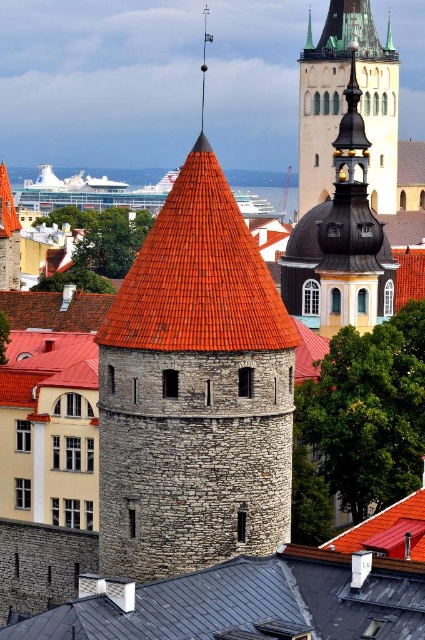
What is located at the coordinates point (252, 602) in the image of Tallinn, Estonia?

The black metal roof at center is located at point (252, 602).

You are standing at the base of the cylindrical stone tower in Tallinn and looking towards the dark domed roof structure. There are two points marked on the image at coordinates point (282, 573) and point (311, 29). Which of these points is nearer to your current position?

Point (282, 573) is closer to the camera than point (311, 29), so the point (282, 573) is nearer to your current position.

You are a tourist in Tallinn, Estonia, and you see the black metal roof at center and the red tiled roof at center in the distance. Which roof would appear larger to you from your current viewpoint?

The red tiled roof at center appears larger than the black metal roof at center because it is bigger in size.